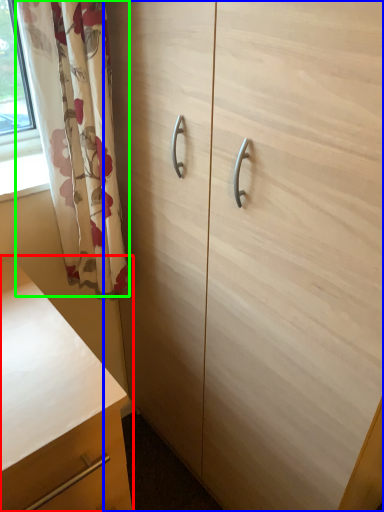
Question: Which is nearer to the chest of drawers (highlighted by a red box)? cabinetry (highlighted by a blue box) or curtain (highlighted by a green box).

Choices:
 (A) cabinetry
 (B) curtain

Answer: (B)